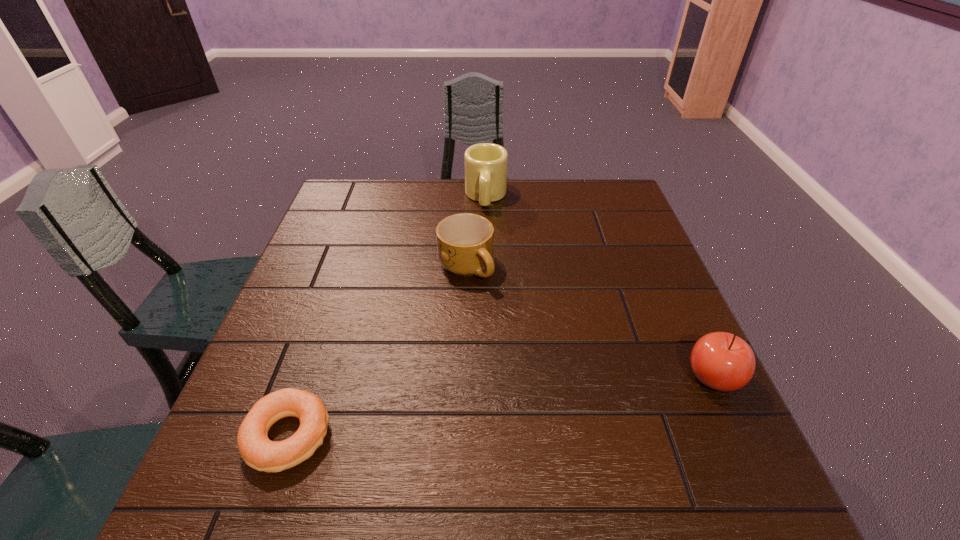
In order to click on vacant space at the far edge of the desktop in this screenshot , I will do `click(580, 219)`.

The width and height of the screenshot is (960, 540). I want to click on vacant area at the near edge of the desktop, so click(339, 409).

Where is `free location at the left edge of the desktop`? The image size is (960, 540). free location at the left edge of the desktop is located at coordinates (280, 329).

Image resolution: width=960 pixels, height=540 pixels. Find the location of `vacant space at the right edge of the desktop`. vacant space at the right edge of the desktop is located at coordinates (659, 295).

Locate an element on the screen. Image resolution: width=960 pixels, height=540 pixels. vacant space at the far left corner of the desktop is located at coordinates (374, 217).

At what (x,y) coordinates should I click in order to perform the action: click on vacant area that lies between the farthest object and the bagel. Please return your answer as a coordinate pair (x, y). This screenshot has width=960, height=540. Looking at the image, I should click on (387, 316).

This screenshot has width=960, height=540. I want to click on empty space that is in between the second shortest object and the shortest object, so click(x=377, y=352).

In order to click on vacant area that lies between the nearer mug and the shortest object in this screenshot , I will do `click(377, 352)`.

Find the location of a particular element. The image size is (960, 540). free spot between the bagel and the rightmost object is located at coordinates (501, 407).

Where is `vacant space in between the second shortest object and the rightmost object`? Image resolution: width=960 pixels, height=540 pixels. vacant space in between the second shortest object and the rightmost object is located at coordinates (589, 322).